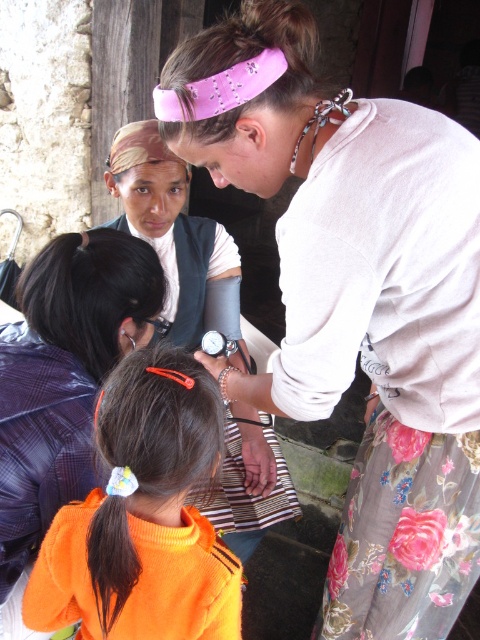
Who is taller, pink fabric headband at upper center or orange fabric hair tie at lower left?

pink fabric headband at upper center

Can you confirm if pink fabric headband at upper center is positioned to the right of orange fabric hair tie at lower left?

Correct, you'll find pink fabric headband at upper center to the right of orange fabric hair tie at lower left.

What do you see at coordinates (356, 301) in the screenshot?
I see `pink fabric headband at upper center` at bounding box center [356, 301].

You are a GUI agent. You are given a task and a screenshot of the screen. Output one action in this format:
    pyautogui.click(x=<x>, y=<y>)
    Task: Click on the pink fabric headband at upper center
    This screenshot has width=480, height=640.
    Given the screenshot: What is the action you would take?
    pyautogui.click(x=356, y=301)

Does orange fabric hair tie at lower left have a greater height compared to orange fabric at center?

No, orange fabric hair tie at lower left is not taller than orange fabric at center.

At what (x,y) coordinates should I click in order to perform the action: click on orange fabric hair tie at lower left. Please return your answer as a coordinate pair (x, y). The height and width of the screenshot is (640, 480). Looking at the image, I should click on (63, 376).

You are a GUI agent. You are given a task and a screenshot of the screen. Output one action in this format:
    pyautogui.click(x=<x>, y=<y>)
    Task: Click on the orange fabric hair tie at lower left
    
    Given the screenshot: What is the action you would take?
    pyautogui.click(x=63, y=376)

Which is in front, point (169, 536) or point (6, 436)?

Point (169, 536)

Can you confirm if orange fabric hair tie at center is taller than orange fabric hair tie at lower left?

No, orange fabric hair tie at center is not taller than orange fabric hair tie at lower left.

Is point (145, 422) closer to camera compared to point (4, 593)?

Yes, point (145, 422) is in front of point (4, 593).

Image resolution: width=480 pixels, height=640 pixels. Identify the location of orange fabric hair tie at center. (144, 516).